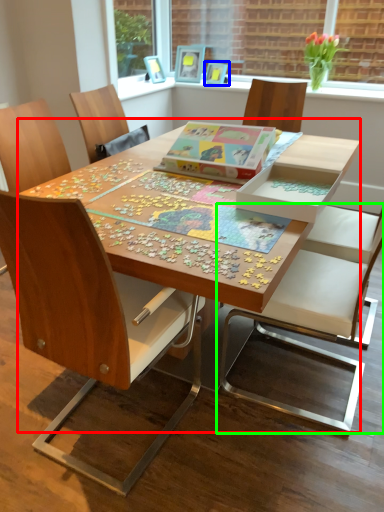
Question: Considering the real-world distances, which object is closest to table (highlighted by a red box)? picture frame (highlighted by a blue box) or chair (highlighted by a green box).

Choices:
 (A) picture frame
 (B) chair

Answer: (B)